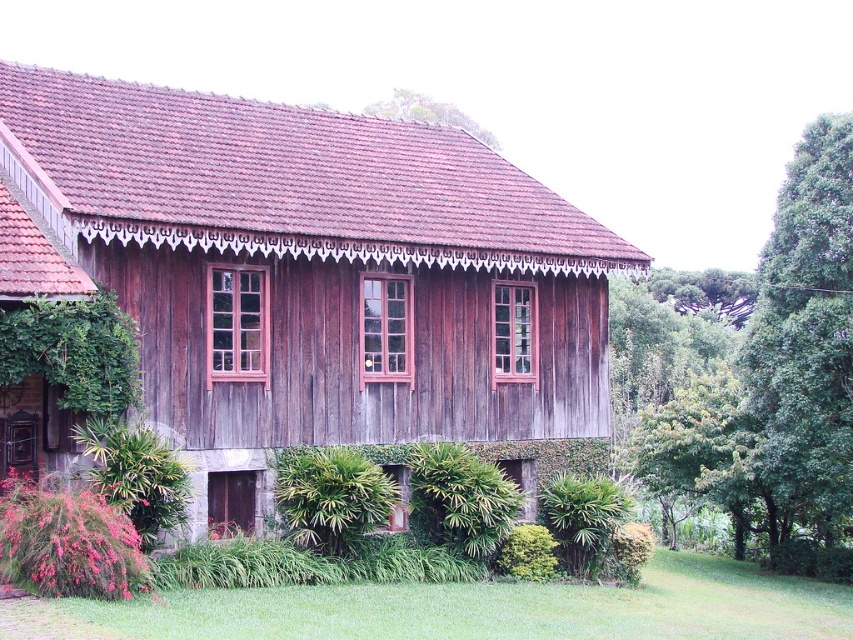
You are standing in front of the weathered wood house at center and the green leafy plant at lower center. If you were to walk towards the house, would the plant become visible or hidden from your view?

The weathered wood house at center is positioned over the green leafy plant at lower center, so as you walk towards the house, the plant would become hidden from your view because the house is above it.

You are standing in front of the weathered wood house at center and looking up. There is a green leafy tree at upper center above it. Which object is larger in size?

The weathered wood house at center is smaller than the green leafy tree at upper center, so the green leafy tree at upper center is larger in size.

You are a painter standing at the base of the weathered wood house at center and the green leafy plant at lower center. You want to paint the entire height of both objects. Which object will require you to use a ladder to reach its top?

The weathered wood house at center has a greater height compared to the green leafy plant at lower center, so you will need a ladder to reach the top of the weathered wood house at center.